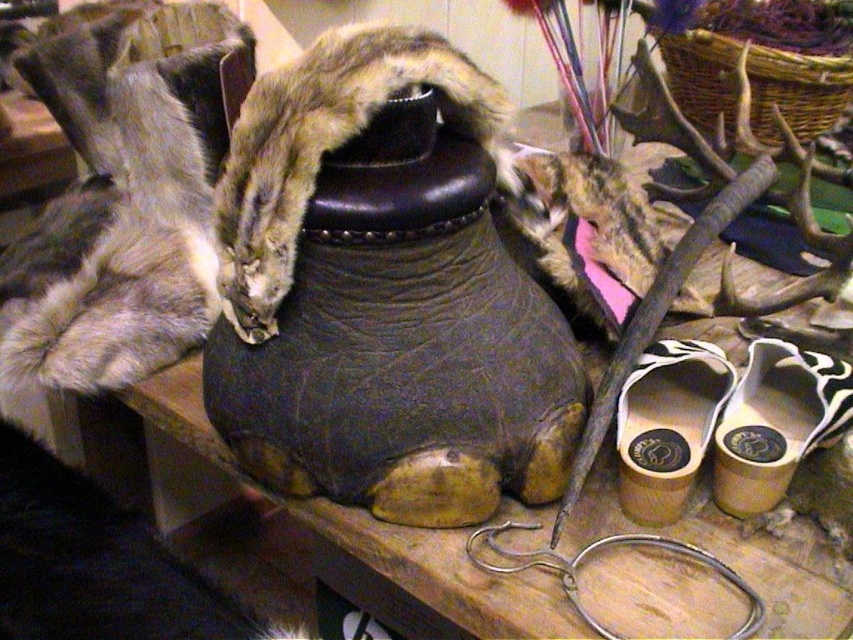
You are organizing a display of footwear and need to place the white leather shoe at lower right and the wooden shoe at lower right on a shelf. According to the image, which shoe should be placed to the left to maintain the original arrangement?

Result: The wooden shoe at lower right should be placed to the left because the white leather shoe at lower right is positioned on the right side of the wooden shoe at lower right in the image.

You are a customer in a rustic home decor store and want to pick up both the white leather shoe at lower right and the wooden shoe at lower right. Which one should you grab first if you want to pick them up in the order closest to farthest from you?

You should grab the white leather shoe at lower right first because it is closer to you than the wooden shoe at lower right, which is further away.

You are organizing a display and need to place the white leather shoe at lower right and the wooden shoe at lower right side by side on a shelf. Which shoe should be placed first to ensure both fit on the shelf?

The white leather shoe at lower right has a greater width than the wooden shoe at lower right. To ensure both fit side by side, place the wooden shoe at lower right first, then the white leather shoe at lower right next to it.